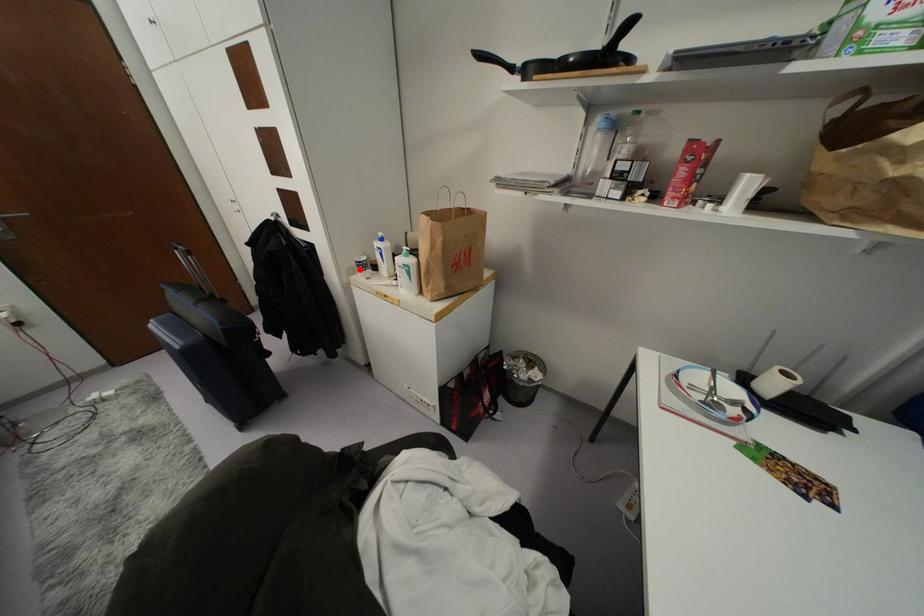
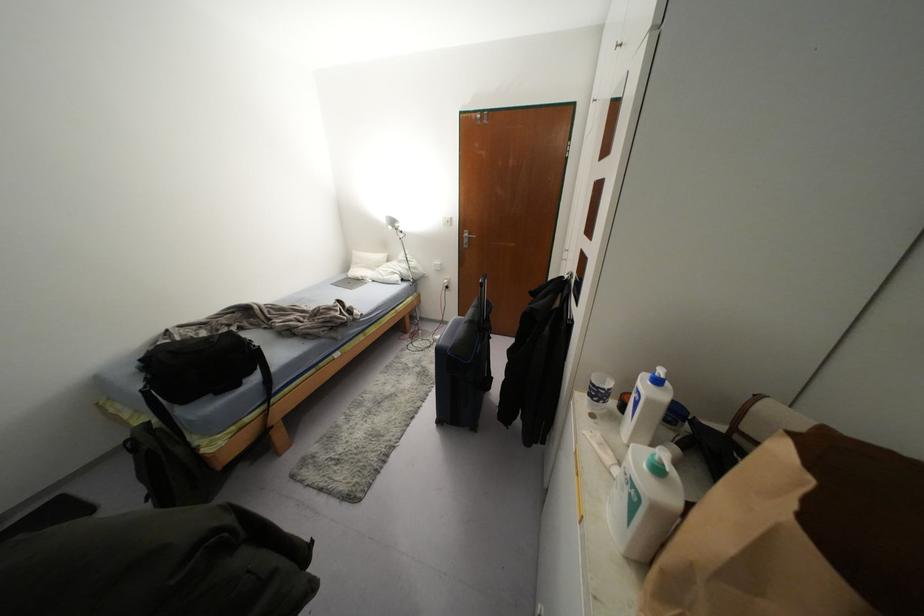
Question: I am providing you with two images of the same scene from different viewpoints. In image1, a red point is highlighted. Considering the same 3D point in image2, which of the following is correct?

Choices:
 (A) It is closer
 (B) It is farther

Answer: (A)